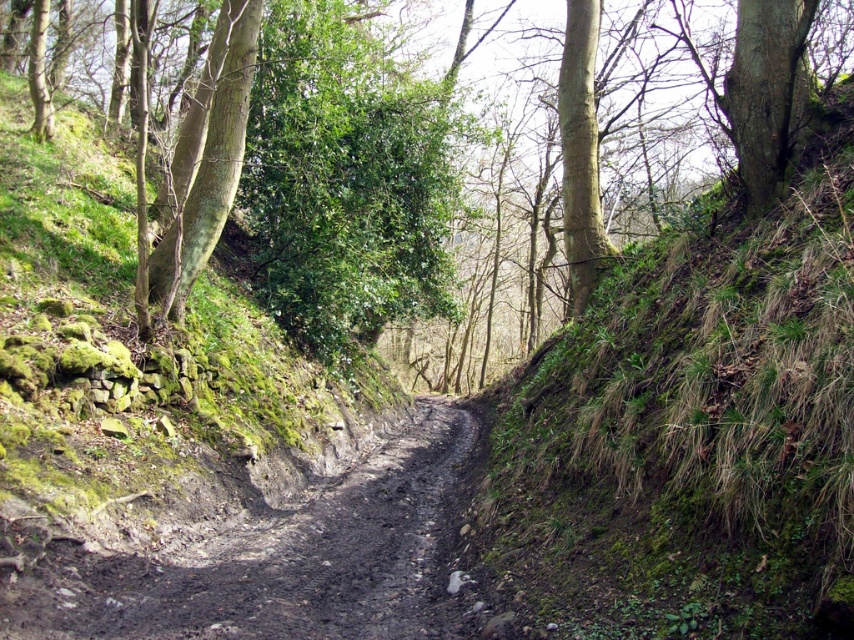
Question: Can you confirm if green rough bark tree at left is smaller than smooth bark tree at upper center?

Choices:
 (A) yes
 (B) no

Answer: (A)

Question: Does green leafy tree at center appear on the left side of dusty brown dirt track at center?

Choices:
 (A) yes
 (B) no

Answer: (B)

Question: Which is farther from the green rough bark tree at left?

Choices:
 (A) dusty brown dirt track at center
 (B) green leafy tree at center
 (C) smooth bark tree at upper center

Answer: (B)

Question: Which point appears closest to the camera in this image?

Choices:
 (A) (446, 433)
 (B) (180, 298)

Answer: (B)

Question: Among these points, which one is farthest from the camera?

Choices:
 (A) (455, 419)
 (B) (176, 172)
 (C) (301, 52)
 (D) (566, 10)

Answer: (A)

Question: Is dusty brown dirt track at center above smooth bark tree at upper center?

Choices:
 (A) no
 (B) yes

Answer: (A)